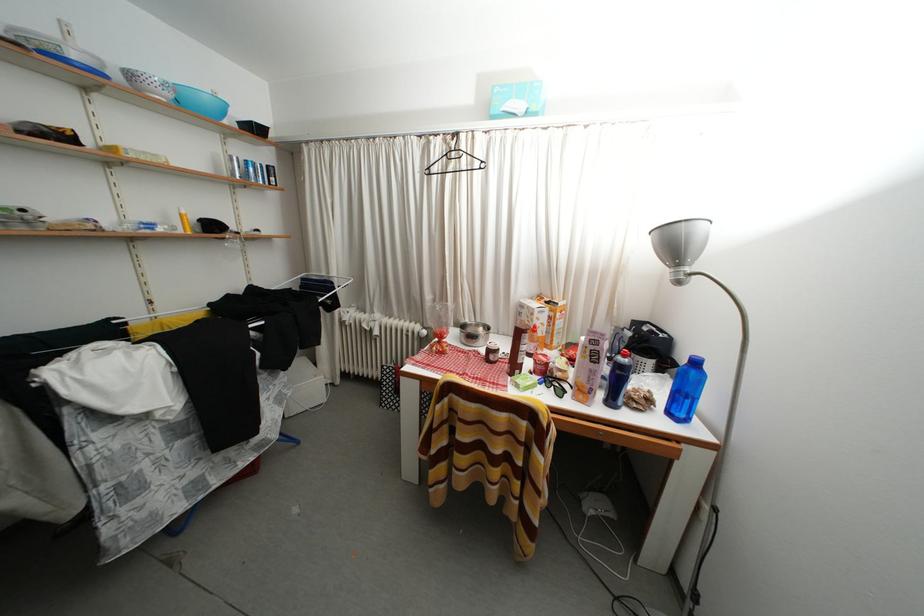
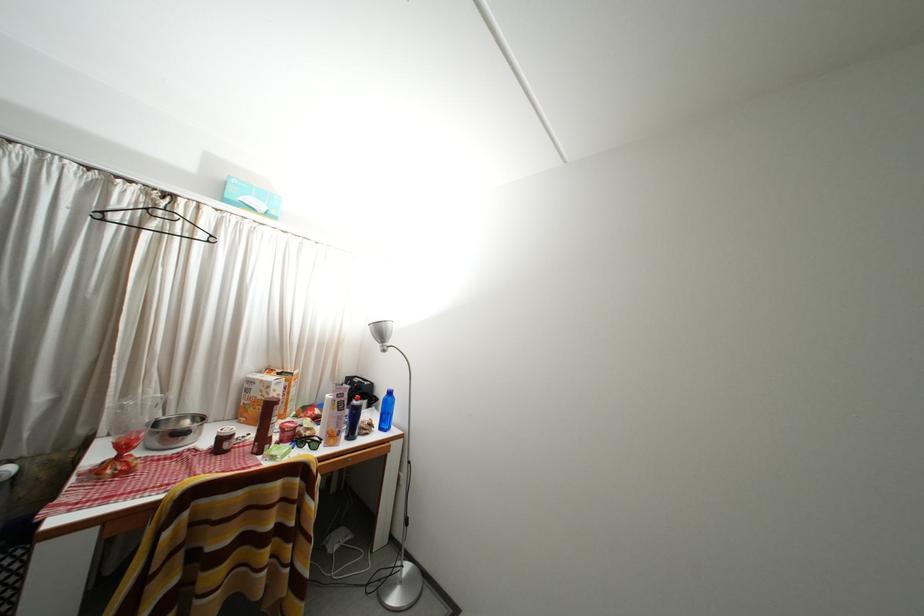
Find the pixel in the second image that matches [485,331] in the first image.

(188, 424)